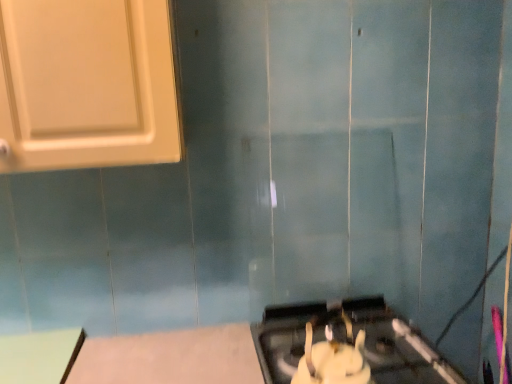
This screenshot has height=384, width=512. Describe the element at coordinates (345, 346) in the screenshot. I see `white glossy gas stove at lower center` at that location.

This screenshot has width=512, height=384. I want to click on white glossy gas stove at lower center, so click(x=345, y=346).

Locate an element on the screen. The width and height of the screenshot is (512, 384). white glossy gas stove at lower center is located at coordinates (345, 346).